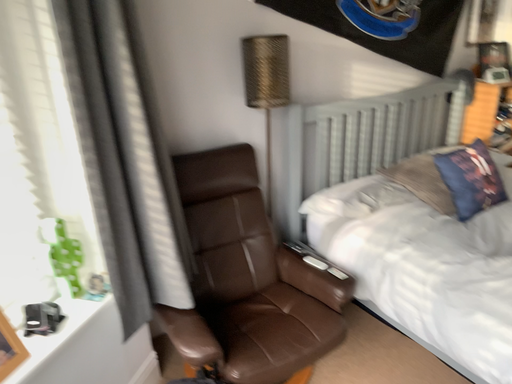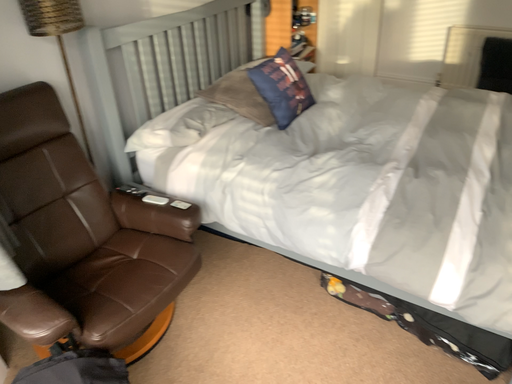
Question: Which way did the camera rotate in the video?

Choices:
 (A) rotated left
 (B) rotated right

Answer: (B)